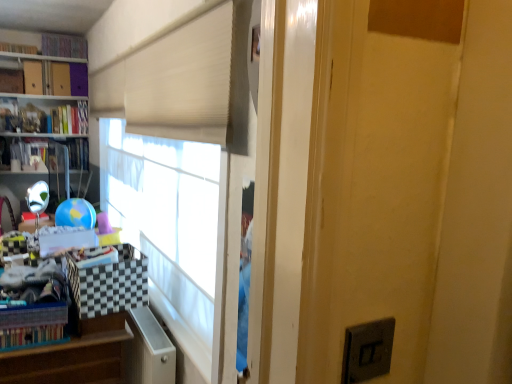
Question: Is wooden at left next to hardcover book at left, the 1th book from the bottom, and touching it?

Choices:
 (A) yes
 (B) no

Answer: (B)

Question: Is wooden at left taller than hardcover book at left, which is counted as the fourth book, starting from the top?

Choices:
 (A) yes
 (B) no

Answer: (A)

Question: Does wooden at left contain hardcover book at left, the 1th book from the bottom?

Choices:
 (A) yes
 (B) no

Answer: (B)

Question: Can you confirm if wooden at left is thinner than hardcover book at left, which is counted as the fourth book, starting from the top?

Choices:
 (A) yes
 (B) no

Answer: (B)

Question: Is wooden at left positioned beyond the bounds of hardcover book at left, the 1th book from the bottom?

Choices:
 (A) yes
 (B) no

Answer: (A)

Question: From their relative heights in the image, would you say hardcover book at upper left, which is the 2th book from top to bottom, is taller or shorter than multicolored fabric book at upper left, which appears as the 1th book when viewed from the top?

Choices:
 (A) short
 (B) tall

Answer: (A)

Question: Considering the positions of hardcover book at upper left, which is the 2th book from top to bottom, and multicolored fabric book at upper left, which appears as the 1th book when viewed from the top, in the image, is hardcover book at upper left, which is the 2th book from top to bottom, wider or thinner than multicolored fabric book at upper left, which appears as the 1th book when viewed from the top,?

Choices:
 (A) thin
 (B) wide

Answer: (A)

Question: Considering the positions of point (10, 51) and point (74, 56), is point (10, 51) closer or farther from the camera than point (74, 56)?

Choices:
 (A) farther
 (B) closer

Answer: (B)

Question: From the image's perspective, is hardcover book at upper left, which is the 2th book from top to bottom, above or below multicolored fabric book at upper left, which appears as the 1th book when viewed from the top?

Choices:
 (A) above
 (B) below

Answer: (B)

Question: Is hardcover book at upper left, acting as the second book starting from the bottom, wider or thinner than hardcover book at left, which is counted as the fourth book, starting from the top?

Choices:
 (A) wide
 (B) thin

Answer: (A)

Question: In the image, is hardcover book at upper left, marked as the third book in a top-to-bottom arrangement, positioned in front of or behind hardcover book at left, the 1th book from the bottom?

Choices:
 (A) front
 (B) behind

Answer: (B)

Question: Looking at the image, does hardcover book at upper left, marked as the third book in a top-to-bottom arrangement, seem bigger or smaller compared to hardcover book at left, the 1th book from the bottom?

Choices:
 (A) small
 (B) big

Answer: (A)

Question: Is hardcover book at upper left, marked as the third book in a top-to-bottom arrangement, taller or shorter than hardcover book at left, which is counted as the fourth book, starting from the top?

Choices:
 (A) short
 (B) tall

Answer: (B)

Question: Is multicolored fabric book at upper left, which is the fourth book from bottom to top, inside the boundaries of hardcover book at upper left, which is the 2th book from top to bottom, or outside?

Choices:
 (A) outside
 (B) inside

Answer: (A)

Question: Is point (53, 41) closer or farther from the camera than point (13, 46)?

Choices:
 (A) farther
 (B) closer

Answer: (A)